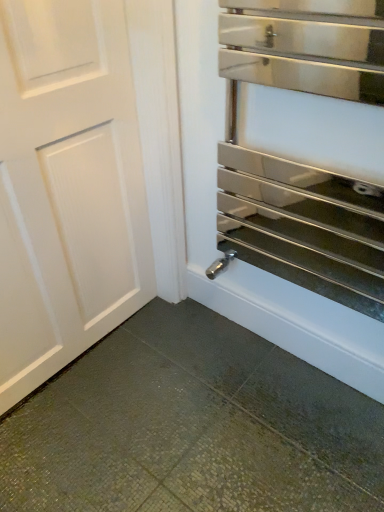
Question: Is point (334, 371) closer or farther from the camera than point (39, 245)?

Choices:
 (A) closer
 (B) farther

Answer: (B)

Question: From a real-world perspective, relative to white matte door at left, is polished stainless steel oven at right vertically above or below?

Choices:
 (A) above
 (B) below

Answer: (A)

Question: Considering the positions of polished stainless steel oven at right and white matte door at left in the image, is polished stainless steel oven at right bigger or smaller than white matte door at left?

Choices:
 (A) small
 (B) big

Answer: (A)

Question: Is white matte door at left taller or shorter than polished stainless steel oven at right?

Choices:
 (A) tall
 (B) short

Answer: (A)

Question: From a real-world perspective, is white matte door at left physically located above or below polished stainless steel oven at right?

Choices:
 (A) below
 (B) above

Answer: (A)

Question: Considering the positions of white matte door at left and polished stainless steel oven at right in the image, is white matte door at left bigger or smaller than polished stainless steel oven at right?

Choices:
 (A) small
 (B) big

Answer: (B)

Question: Do you think white matte door at left is within polished stainless steel oven at right, or outside of it?

Choices:
 (A) outside
 (B) inside

Answer: (A)